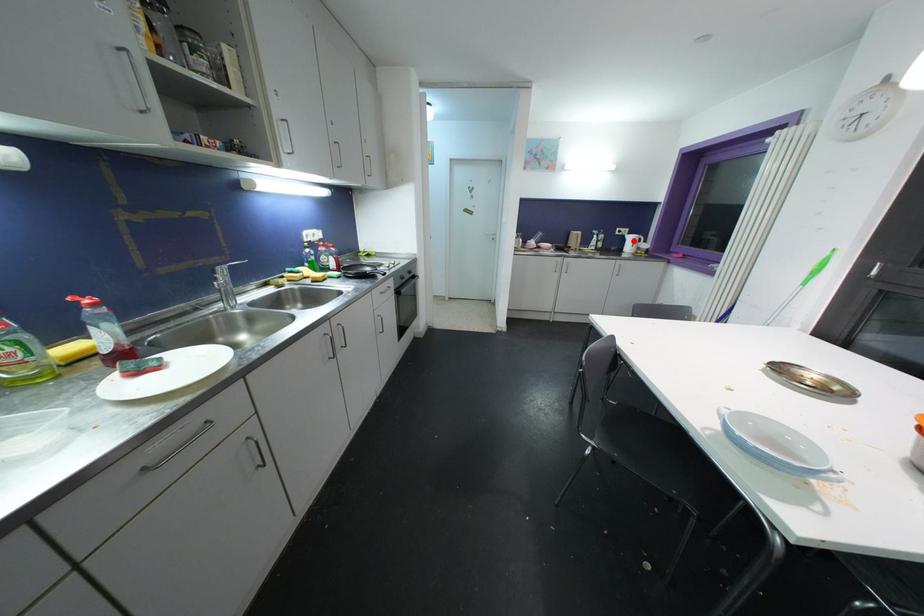
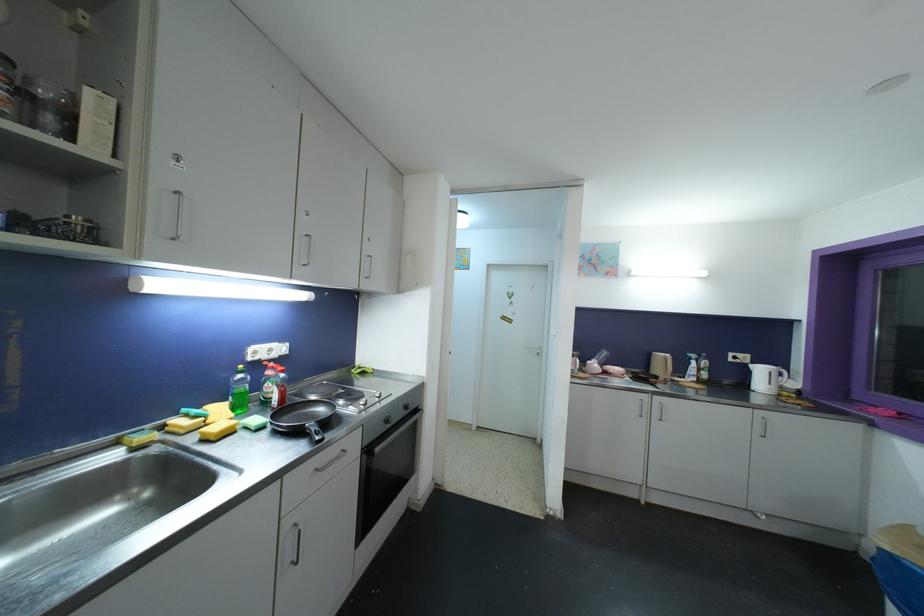
Question: I am providing you with two images of the same scene from different viewpoints. Given a red point in image1, look at the same physical point in image2. Is it:

Choices:
 (A) Closer to the viewpoint
 (B) Farther from the viewpoint

Answer: (B)